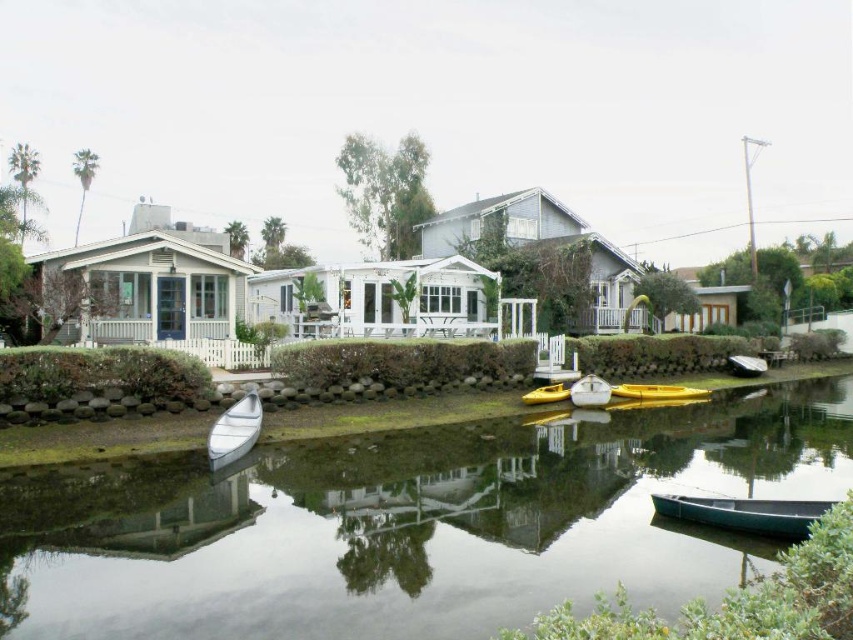
Question: Does green matte canoe at lower right appear on the left side of yellow matte canoe at center?

Choices:
 (A) no
 (B) yes

Answer: (B)

Question: Among these points, which one is nearest to the camera?

Choices:
 (A) (581, 392)
 (B) (734, 515)
 (C) (549, 401)
 (D) (637, 536)

Answer: (B)

Question: Is green matte canoe at lower right to the right of yellow matte kayak at center from the viewer's perspective?

Choices:
 (A) no
 (B) yes

Answer: (B)

Question: Is green matte canoe at lower right thinner than yellow matte kayak at center?

Choices:
 (A) no
 (B) yes

Answer: (A)

Question: Which point is farther to the camera?

Choices:
 (A) clear water at center
 (B) white glossy boat at lower left
 (C) green matte canoe at lower right
 (D) white glossy boat at center

Answer: (D)

Question: Which object is the farthest from the yellow matte canoe at center?

Choices:
 (A) white glossy boat at center
 (B) green matte canoe at lower right
 (C) yellow matte kayak at center

Answer: (B)